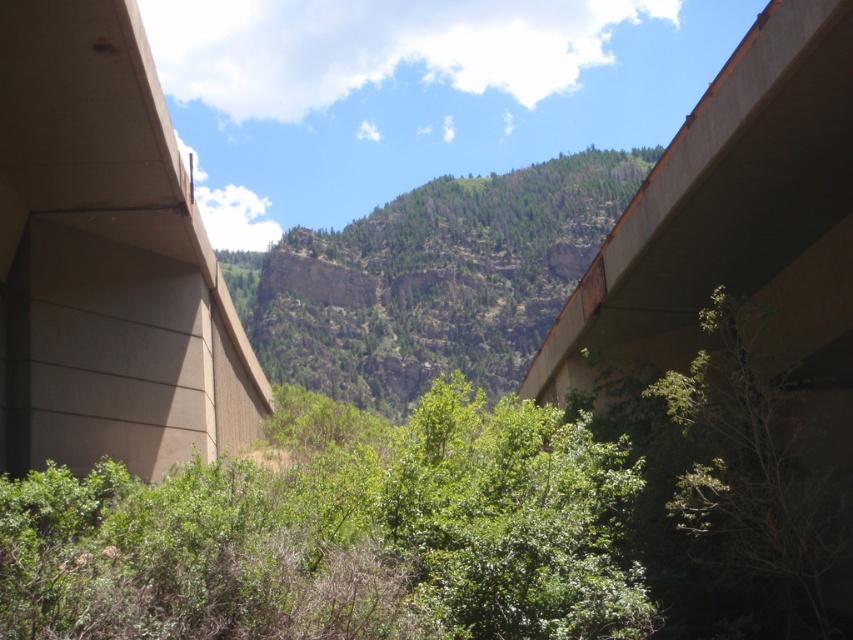
You are standing at the point with coordinates (106,259) in the image. What structure are you likely standing on?

You are likely standing on the concrete overpass at left as the coordinates point to that structure.

You are a delivery driver approaching the concrete overpass at left and the concrete bridge at upper right. Which structure will you encounter first on your route?

You will encounter the concrete overpass at left first because the concrete bridge at upper right is positioned behind it, meaning the overpass is closer to your current position.